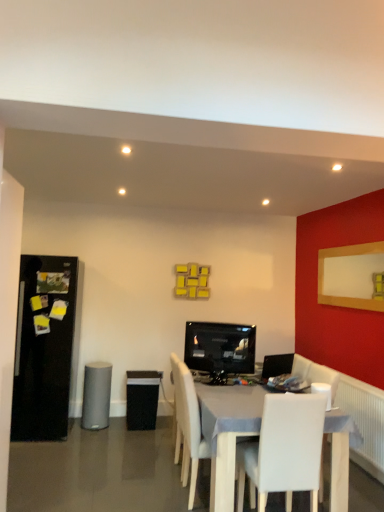
Question: From a real-world perspective, is black glossy tv at center beneath white leather chair at center, acting as the first chair starting from the front?

Choices:
 (A) no
 (B) yes

Answer: (A)

Question: Can you confirm if black glossy tv at center is thinner than white leather chair at center, acting as the first chair starting from the front?

Choices:
 (A) no
 (B) yes

Answer: (B)

Question: From the image's perspective, is black glossy tv at center on top of white leather chair at center, acting as the first chair starting from the front?

Choices:
 (A) no
 (B) yes

Answer: (B)

Question: Can you confirm if black glossy tv at center is positioned to the left of white leather chair at center, the 2th chair when ordered from back to front?

Choices:
 (A) yes
 (B) no

Answer: (A)

Question: Is black glossy tv at center in front of white leather chair at center, the 2th chair when ordered from back to front?

Choices:
 (A) no
 (B) yes

Answer: (A)

Question: Is point (225, 505) closer or farther from the camera than point (326, 394)?

Choices:
 (A) closer
 (B) farther

Answer: (B)

Question: From the image's perspective, relative to white plastic speaker at lower right, the first speaker in the right-to-left sequence, is white wood chair at center, placed as the first chair when sorted from back to front, above or below?

Choices:
 (A) below
 (B) above

Answer: (A)

Question: Do you think white wood chair at center, which is the 2th chair in front-to-back order, is within white plastic speaker at lower right, the third speaker when ordered from left to right, or outside of it?

Choices:
 (A) outside
 (B) inside

Answer: (A)

Question: In terms of size, does white wood chair at center, placed as the first chair when sorted from back to front, appear bigger or smaller than white plastic speaker at lower right, placed as the 3th speaker when sorted from back to front?

Choices:
 (A) big
 (B) small

Answer: (A)

Question: In the image, is black mesh speaker at center, acting as the 2th speaker starting from the right, positioned in front of or behind black glossy tv at center?

Choices:
 (A) front
 (B) behind

Answer: (B)

Question: From a real-world perspective, relative to black glossy tv at center, is black mesh speaker at center, positioned as the 1th speaker in back-to-front order, vertically above or below?

Choices:
 (A) below
 (B) above

Answer: (A)

Question: Considering the positions of point click(142, 400) and point click(218, 342), is point click(142, 400) closer or farther from the camera than point click(218, 342)?

Choices:
 (A) farther
 (B) closer

Answer: (A)

Question: From their relative heights in the image, would you say black mesh speaker at center, acting as the 2th speaker starting from the right, is taller or shorter than black glossy tv at center?

Choices:
 (A) short
 (B) tall

Answer: (B)

Question: Based on their positions, is black mesh speaker at center, acting as the third speaker starting from the front, located to the left or right of gray matte speaker at lower left, the first speaker from the left?

Choices:
 (A) right
 (B) left

Answer: (A)

Question: Is black mesh speaker at center, positioned as the 1th speaker in back-to-front order, taller or shorter than gray matte speaker at lower left, the second speaker viewed from the front?

Choices:
 (A) tall
 (B) short

Answer: (B)